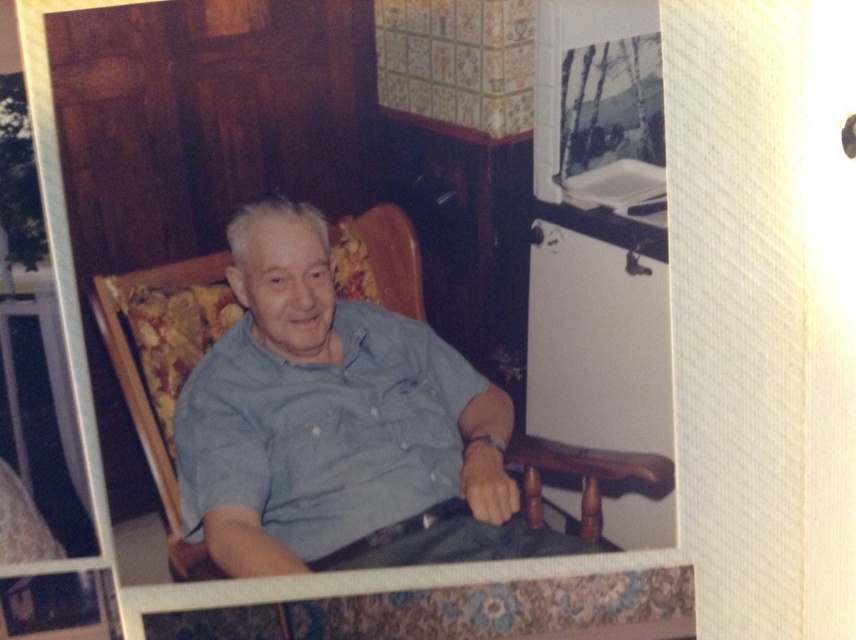
You are an interior designer planning to hang a picture frame exactly at the coordinates provided in the scene. Where should you place the frame so it aligns with the blue cotton shirt at center?

The blue cotton shirt at center is located at coordinates point (334, 424), so the picture frame should be placed at those coordinates to align with it.

You are standing in the room and want to place a small plant between the blue cotton shirt at center and the dark green fabric at lower center. Can you do this without moving either object?

The blue cotton shirt at center is to the left of the dark green fabric at lower center, so you can place the plant between them as long as there is enough space between the two objects.